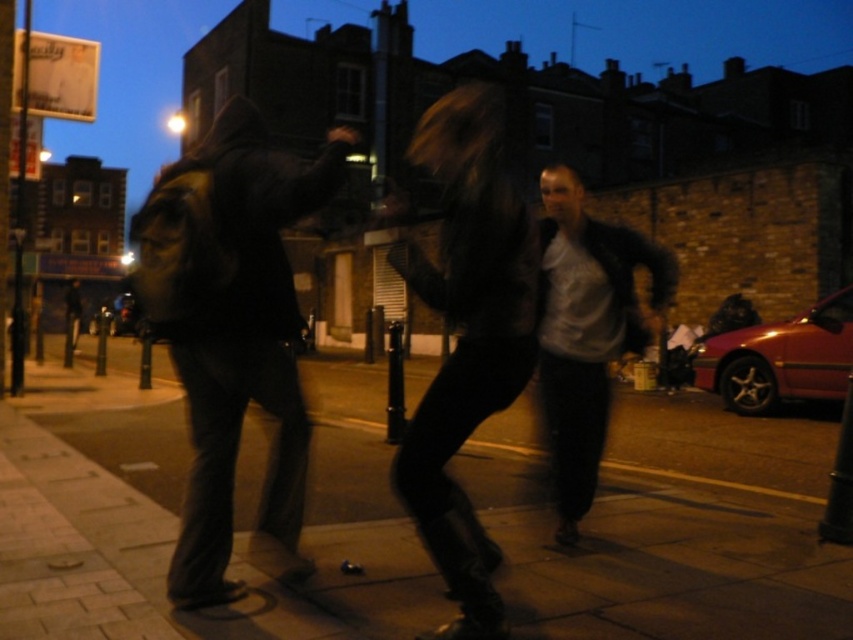
You are standing at the origin point in the image. Can you tell me the 2D coordinates of the dark matte jacket at left?

The dark matte jacket at left is located at coordinates 0.514 in the x axis and 0.272 in the y axis.

You are a photographer standing on the street and want to take a photo of both the dark matte jacket at left and the white matte jacket at center. Based on their positions, which jacket will appear closer to the camera in the photo?

The dark matte jacket at left will appear closer to the camera in the photo because it is in front of the white matte jacket at center according to their positions.